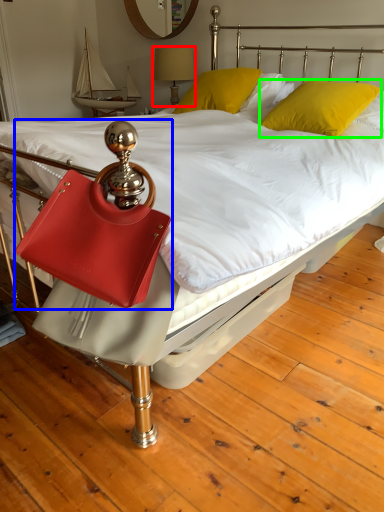
Question: Which is farther away from bedside lamp (highlighted by a red box)? handbag (highlighted by a blue box) or pillow (highlighted by a green box)?

Choices:
 (A) handbag
 (B) pillow

Answer: (A)